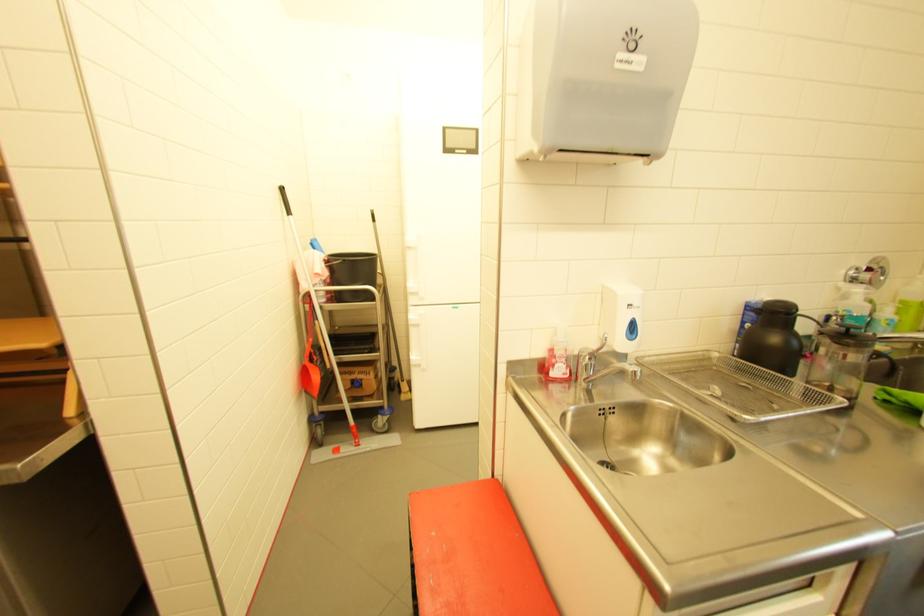
The image size is (924, 616). In order to click on white refrigerator handle in this screenshot , I will do `click(419, 341)`.